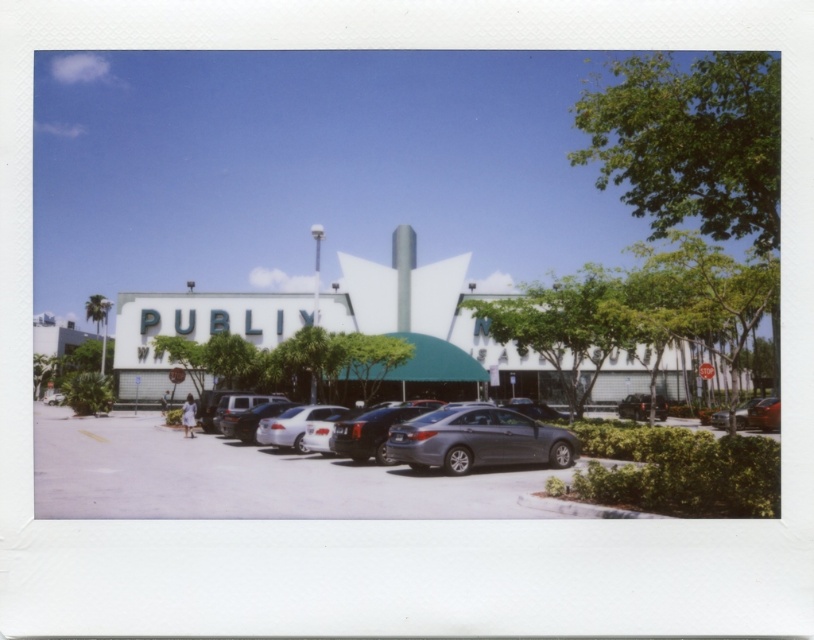
Question: Which object appears farthest from the camera in this image?

Choices:
 (A) metallic silver sedan at center
 (B) satin silver sedan at center

Answer: (A)

Question: Which object appears farthest from the camera in this image?

Choices:
 (A) gray asphalt parking lot at center
 (B) satin silver sedan at center
 (C) matte gray sedan at center
 (D) metallic silver sedan at center

Answer: (D)

Question: Does gray asphalt parking lot at center have a greater width compared to shiny black sedan at center?

Choices:
 (A) yes
 (B) no

Answer: (A)

Question: Considering the relative positions of satin silver sedan at center and metallic silver sedan at right in the image provided, where is satin silver sedan at center located with respect to metallic silver sedan at right?

Choices:
 (A) above
 (B) below

Answer: (A)

Question: Is satin gray sedan at center bigger than metallic silver sedan at center?

Choices:
 (A) no
 (B) yes

Answer: (A)

Question: Which object is positioned farthest from the satin silver sedan at center?

Choices:
 (A) satin gray sedan at center
 (B) gray asphalt parking lot at center
 (C) metallic silver sedan at right
 (D) metallic silver sedan at center

Answer: (D)